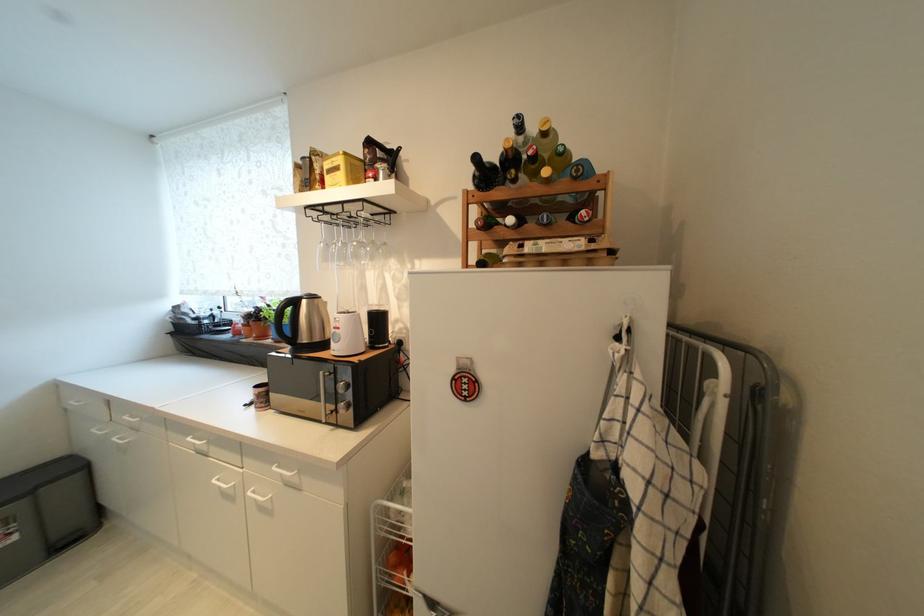
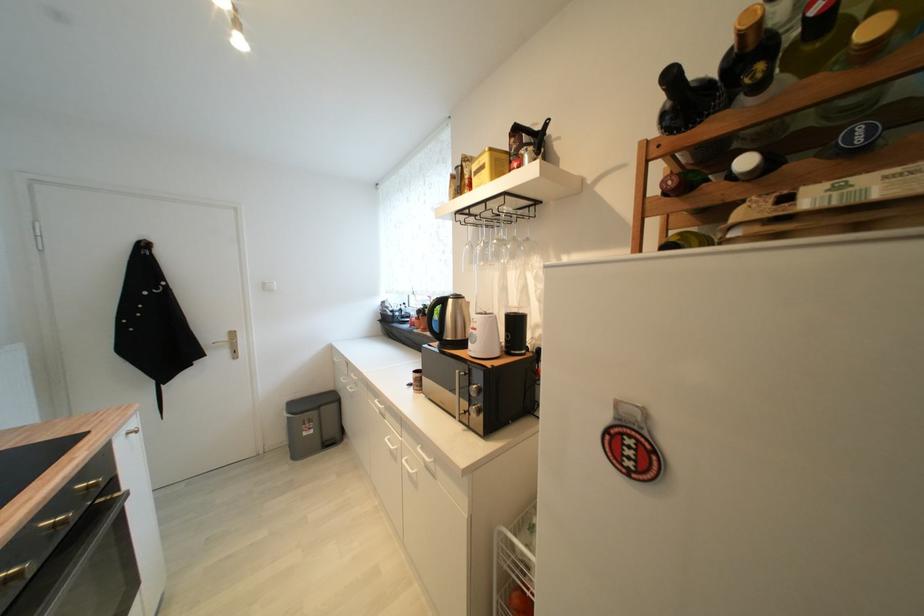
The point at (263, 312) is marked in the first image. Where is the corresponding point in the second image?

(431, 309)